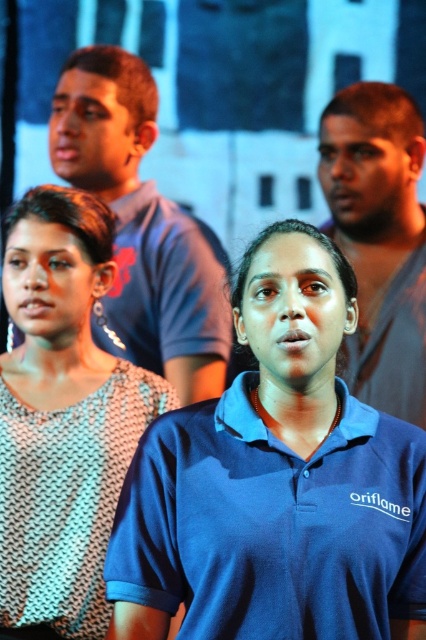
Question: Which of the following is the farthest from the observer?

Choices:
 (A) (193, 257)
 (B) (282, 472)

Answer: (A)

Question: Estimate the real-world distances between objects in this image. Which object is closer to the matte blue shirt at upper center?

Choices:
 (A) matte gray shirt at center
 (B) knitted fabric top at center

Answer: (A)

Question: Which of the following is the closest to the observer?

Choices:
 (A) knitted fabric top at center
 (B) matte blue shirt at upper center
 (C) blue smooth polo shirt at center
 (D) matte gray shirt at center

Answer: (C)

Question: Does blue smooth polo shirt at center appear on the right side of matte blue shirt at upper center?

Choices:
 (A) yes
 (B) no

Answer: (A)

Question: Does knitted fabric top at center appear over matte gray shirt at center?

Choices:
 (A) no
 (B) yes

Answer: (A)

Question: Where is blue smooth polo shirt at center located in relation to matte blue shirt at upper center in the image?

Choices:
 (A) right
 (B) left

Answer: (A)